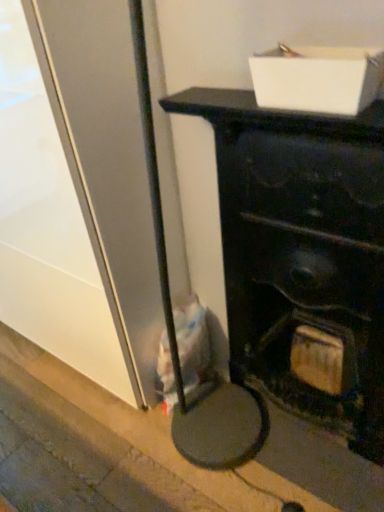
Find the location of `vacant space situated above concrete at lower left (from a real-world perspective)`. vacant space situated above concrete at lower left (from a real-world perspective) is located at coordinates (114, 428).